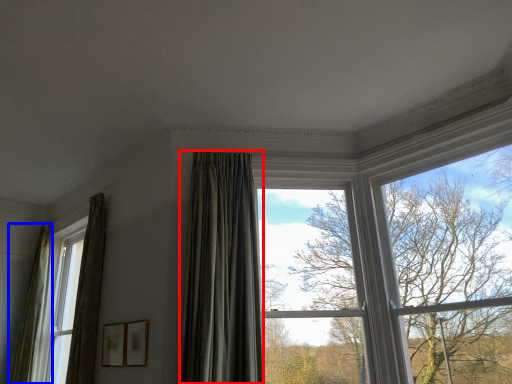
Question: Which of the following is the closest to the observer, curtain (highlighted by a red box) or curtain (highlighted by a blue box)?

Choices:
 (A) curtain
 (B) curtain

Answer: (A)